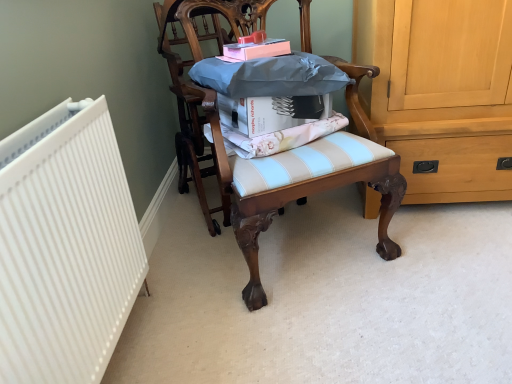
The height and width of the screenshot is (384, 512). Find the location of `white matte book at center, acting as the second book starting from the top`. white matte book at center, acting as the second book starting from the top is located at coordinates (260, 114).

What is the approximate height of light blue striped cushion at center?

It is 7.29 centimeters.

What do you see at coordinates (255, 50) in the screenshot? I see `pink matte book at upper center, marked as the 2th book in a bottom-to-top arrangement` at bounding box center [255, 50].

I want to click on wooden chair at center, arranged as the first chair when viewed from the right, so click(x=276, y=154).

Identify the location of white matte book at center, acting as the second book starting from the top. Image resolution: width=512 pixels, height=384 pixels. (260, 114).

From a real-world perspective, is light blue striped cushion at center physically located above or below wooden chair at center, which ranks as the 2th chair in right-to-left order?

From a real-world perspective, light blue striped cushion at center is physically above wooden chair at center, which ranks as the 2th chair in right-to-left order.

Is light blue striped cushion at center at the right side of wooden chair at center, placed as the first chair when sorted from left to right?

Yes.

Where is `fabric on the right of wooden chair at center, which ranks as the 2th chair in right-to-left order`? The image size is (512, 384). fabric on the right of wooden chair at center, which ranks as the 2th chair in right-to-left order is located at coordinates (279, 137).

Locate an element on the screen. the 1st book above when counting from the wooden chair at center, arranged as the first chair when viewed from the right (from the image's perspective) is located at coordinates point(260,114).

Is wooden chair at center, which is the 2th chair from left to right, oriented away from white matte book at center, positioned as the 1th book in bottom-to-top order?

Yes, wooden chair at center, which is the 2th chair from left to right, is facing away from white matte book at center, positioned as the 1th book in bottom-to-top order.

From the image's perspective, is wooden chair at center, arranged as the first chair when viewed from the right, on white matte book at center, acting as the second book starting from the top?

No, from the image's perspective, wooden chair at center, arranged as the first chair when viewed from the right, is not over white matte book at center, acting as the second book starting from the top.

Could you measure the distance between wooden chair at center, which ranks as the 2th chair in right-to-left order, and light blue striped cushion at center?

wooden chair at center, which ranks as the 2th chair in right-to-left order, and light blue striped cushion at center are 14.97 inches apart.

Between point (193, 136) and point (209, 132), which one is positioned in front?

The point (209, 132) is closer to the camera.

Is the surface of wooden chair at center, which ranks as the 2th chair in right-to-left order, in direct contact with light blue striped cushion at center?

wooden chair at center, which ranks as the 2th chair in right-to-left order, and light blue striped cushion at center are clearly separated.

Does wooden chair at center, placed as the first chair when sorted from left to right, appear on the right side of light blue striped cushion at center?

In fact, wooden chair at center, placed as the first chair when sorted from left to right, is to the left of light blue striped cushion at center.

Are pink matte book at upper center, marked as the 2th book in a bottom-to-top arrangement, and wooden chair at center, arranged as the first chair when viewed from the right, beside each other?

pink matte book at upper center, marked as the 2th book in a bottom-to-top arrangement, is not next to wooden chair at center, arranged as the first chair when viewed from the right, and they're not touching.

Considering the sizes of pink matte book at upper center, the 1th book in the top-to-bottom sequence, and wooden chair at center, which is the 2th chair from left to right, in the image, is pink matte book at upper center, the 1th book in the top-to-bottom sequence, bigger or smaller than wooden chair at center, which is the 2th chair from left to right,?

Considering their sizes, pink matte book at upper center, the 1th book in the top-to-bottom sequence, takes up less space than wooden chair at center, which is the 2th chair from left to right.

From a real-world perspective, between pink matte book at upper center, the 1th book in the top-to-bottom sequence, and wooden chair at center, arranged as the first chair when viewed from the right, who is vertically higher?

pink matte book at upper center, the 1th book in the top-to-bottom sequence.

This screenshot has width=512, height=384. I want to click on chair lying on the right of pink matte book at upper center, marked as the 2th book in a bottom-to-top arrangement, so click(276, 154).

Is pink matte book at upper center, marked as the 2th book in a bottom-to-top arrangement, surrounded by wooden chair at center, which ranks as the 2th chair in right-to-left order?

No, pink matte book at upper center, marked as the 2th book in a bottom-to-top arrangement, is not inside wooden chair at center, which ranks as the 2th chair in right-to-left order.

Find the location of a particular element. chair located on the left of pink matte book at upper center, marked as the 2th book in a bottom-to-top arrangement is located at coordinates (198, 85).

Looking at this image, is wooden chair at center, which ranks as the 2th chair in right-to-left order, oriented towards pink matte book at upper center, marked as the 2th book in a bottom-to-top arrangement?

Yes.

Who is more distant, wooden chair at center, which ranks as the 2th chair in right-to-left order, or pink matte book at upper center, marked as the 2th book in a bottom-to-top arrangement?

wooden chair at center, which ranks as the 2th chair in right-to-left order, is behind.

Considering the sizes of objects light blue striped cushion at center and wooden chair at center, which is the 2th chair from left to right, in the image provided, who is thinner, light blue striped cushion at center or wooden chair at center, which is the 2th chair from left to right,?

light blue striped cushion at center is thinner.

In the scene shown: Is light blue striped cushion at center inside or outside of wooden chair at center, which is the 2th chair from left to right?

light blue striped cushion at center is enclosed within wooden chair at center, which is the 2th chair from left to right.

Is the position of light blue striped cushion at center less distant than that of wooden chair at center, which is the 2th chair from left to right?

No, light blue striped cushion at center is further to the viewer.

Looking at this image, would you say light blue striped cushion at center is to the left or to the right of wooden chair at center, which is the 2th chair from left to right, in the picture?

light blue striped cushion at center is to the left of wooden chair at center, which is the 2th chair from left to right.

Which is more to the right, white matte book at center, acting as the second book starting from the top, or light blue striped cushion at center?

From the viewer's perspective, white matte book at center, acting as the second book starting from the top, appears more on the right side.

Where is `fabric below the white matte book at center, acting as the second book starting from the top (from the image's perspective)`? fabric below the white matte book at center, acting as the second book starting from the top (from the image's perspective) is located at coordinates (279, 137).

In the scene shown: Which of these two, white matte book at center, positioned as the 1th book in bottom-to-top order, or light blue striped cushion at center, is thinner?

white matte book at center, positioned as the 1th book in bottom-to-top order.

The image size is (512, 384). I want to click on fabric above the wooden chair at center, placed as the first chair when sorted from left to right (from a real-world perspective), so click(279, 137).

Locate an element on the screen. the 1st book behind the wooden chair at center, arranged as the first chair when viewed from the right, counting from the anchor's position is located at coordinates (260, 114).

From the image, which object appears to be nearer to white matte book at center, acting as the second book starting from the top, wooden chair at center, which ranks as the 2th chair in right-to-left order, or wooden chair at center, arranged as the first chair when viewed from the right?

The object closer to white matte book at center, acting as the second book starting from the top, is wooden chair at center, arranged as the first chair when viewed from the right.

Considering their positions, is white matte book at center, acting as the second book starting from the top, positioned closer to wooden chair at center, which ranks as the 2th chair in right-to-left order, than pink matte book at upper center, the 1th book in the top-to-bottom sequence?

white matte book at center, acting as the second book starting from the top.

Based on their spatial positions, is white matte book at center, acting as the second book starting from the top, or wooden chair at center, which is the 2th chair from left to right, further from pink matte book at upper center, the 1th book in the top-to-bottom sequence?

wooden chair at center, which is the 2th chair from left to right.

From the image, which object appears to be farther from light blue striped cushion at center, wooden chair at center, which is the 2th chair from left to right, or white matte book at center, positioned as the 1th book in bottom-to-top order?

Based on the image, wooden chair at center, which is the 2th chair from left to right, appears to be further to light blue striped cushion at center.

From the image, which object appears to be farther from wooden chair at center, which is the 2th chair from left to right, white matte book at center, acting as the second book starting from the top, or pink matte book at upper center, marked as the 2th book in a bottom-to-top arrangement?

Based on the image, pink matte book at upper center, marked as the 2th book in a bottom-to-top arrangement, appears to be further to wooden chair at center, which is the 2th chair from left to right.

Looking at the image, which one is located closer to light blue striped cushion at center, wooden chair at center, arranged as the first chair when viewed from the right, or pink matte book at upper center, the 1th book in the top-to-bottom sequence?

Based on the image, wooden chair at center, arranged as the first chair when viewed from the right, appears to be nearer to light blue striped cushion at center.

Estimate the real-world distances between objects in this image. Which object is closer to wooden chair at center, which is the 2th chair from left to right, white matte book at center, acting as the second book starting from the top, or wooden chair at center, which ranks as the 2th chair in right-to-left order?

wooden chair at center, which ranks as the 2th chair in right-to-left order.

Considering their positions, is wooden chair at center, placed as the first chair when sorted from left to right, positioned further to white matte book at center, positioned as the 1th book in bottom-to-top order, than pink matte book at upper center, marked as the 2th book in a bottom-to-top arrangement?

Based on the image, wooden chair at center, placed as the first chair when sorted from left to right, appears to be further to white matte book at center, positioned as the 1th book in bottom-to-top order.

This screenshot has height=384, width=512. I want to click on book between wooden chair at center, which ranks as the 2th chair in right-to-left order, and white matte book at center, positioned as the 1th book in bottom-to-top order, so click(255, 50).

Locate an element on the screen. This screenshot has width=512, height=384. book between wooden chair at center, which ranks as the 2th chair in right-to-left order, and light blue striped cushion at center is located at coordinates (255, 50).

The height and width of the screenshot is (384, 512). Find the location of `fabric located between wooden chair at center, arranged as the first chair when viewed from the right, and wooden chair at center, which ranks as the 2th chair in right-to-left order, in the depth direction`. fabric located between wooden chair at center, arranged as the first chair when viewed from the right, and wooden chair at center, which ranks as the 2th chair in right-to-left order, in the depth direction is located at coordinates (279, 137).

What are the coordinates of `book located between wooden chair at center, which is the 2th chair from left to right, and pink matte book at upper center, marked as the 2th book in a bottom-to-top arrangement, in the depth direction` in the screenshot? It's located at point(260,114).